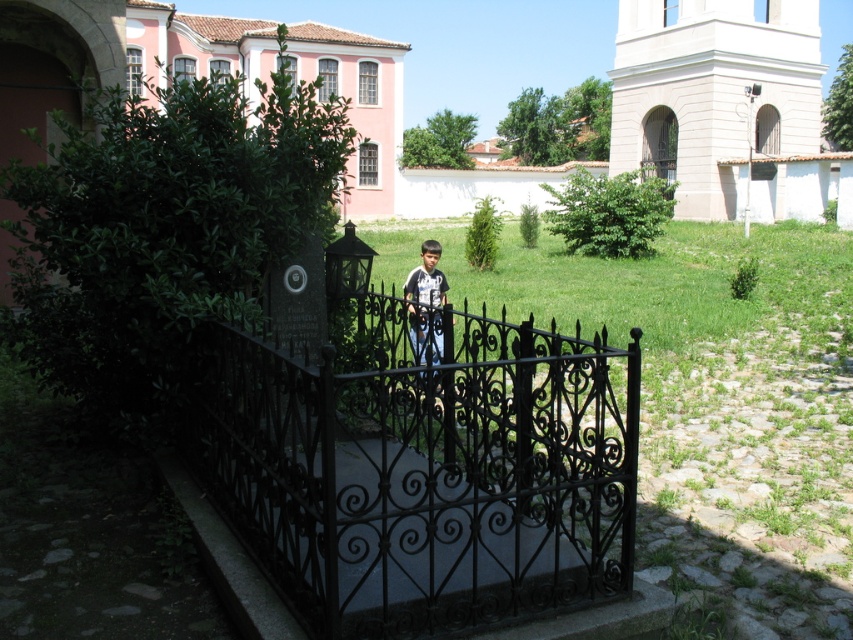
You are a visitor approaching the entrance of the garden. You see the black wrought iron gate at center and the matte black shirt at center. Which object is closer to your left side as you face the entrance?

The black wrought iron gate at center is to the left of matte black shirt at center, so as you face the entrance, the black wrought iron gate at center is closer to your left side.

You are standing at the entrance of the garden and see the white stone church at upper right and the matte black shirt at center. Which object is positioned higher in the image?

The white stone church at upper right is located above the matte black shirt at center, so it is positioned higher in the image.

You are a photographer standing at the entrance of the garden. You want to capture a photo that includes both the white stone church at upper right and the matte black shirt at center. Since the church is taller than the shirt, which object will appear larger in the photo?

The white stone church at upper right will appear larger in the photo because it has a greater height compared to the matte black shirt at center.